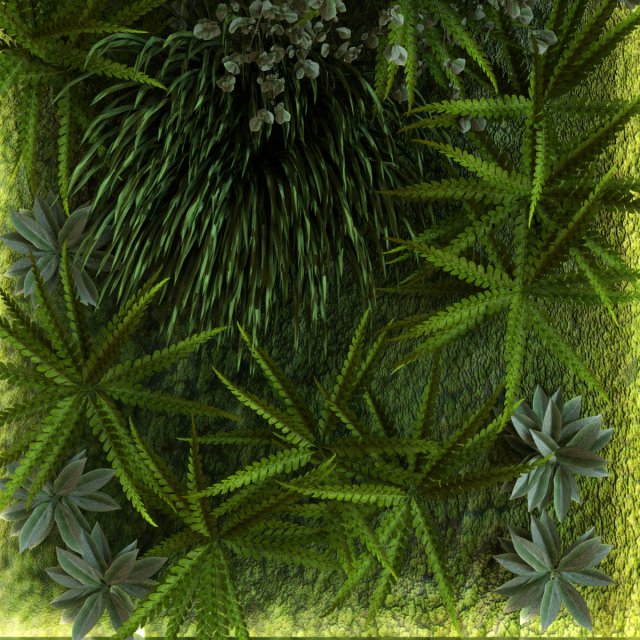
Image resolution: width=640 pixels, height=640 pixels. Find the location of `succulent`. succulent is located at coordinates (569, 452), (45, 257).